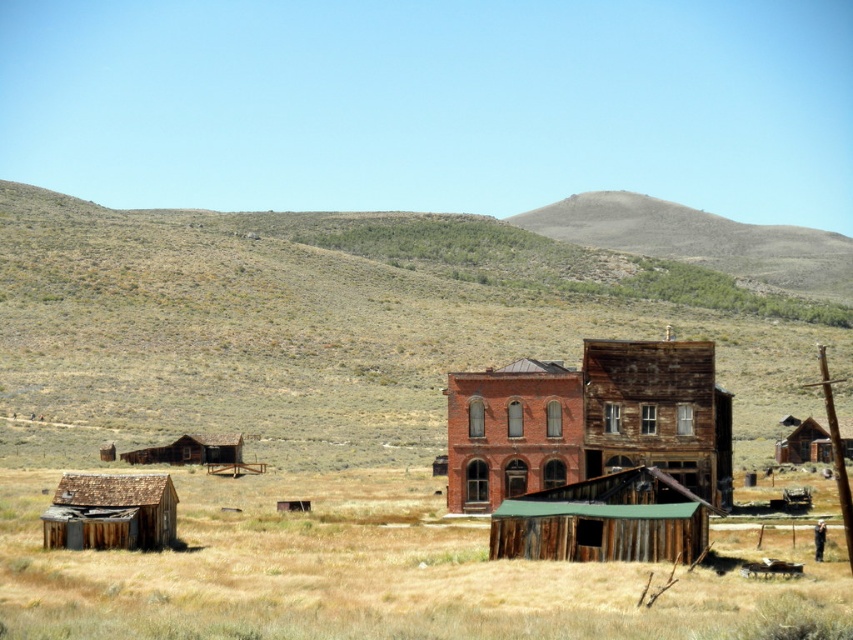
Question: Does red brick building at center appear over rustic wooden hut at left?

Choices:
 (A) yes
 (B) no

Answer: (A)

Question: Is green grassy hillside at center positioned before weathered wood hut at center?

Choices:
 (A) yes
 (B) no

Answer: (B)

Question: Which object is closer to the camera taking this photo?

Choices:
 (A) green grassy hillside at center
 (B) weathered wood hut at center

Answer: (B)

Question: Which of the following is the closest to the observer?

Choices:
 (A) (505, 396)
 (B) (685, 490)

Answer: (B)

Question: Estimate the real-world distances between objects in this image. Which object is closer to the rustic wooden hut at left?

Choices:
 (A) red brick building at center
 (B) brown dry grass at lower left
 (C) weathered wood hut at center
 (D) wooden shack at right

Answer: (B)

Question: Is red brick building at center above weathered wood hut at lower left?

Choices:
 (A) yes
 (B) no

Answer: (A)